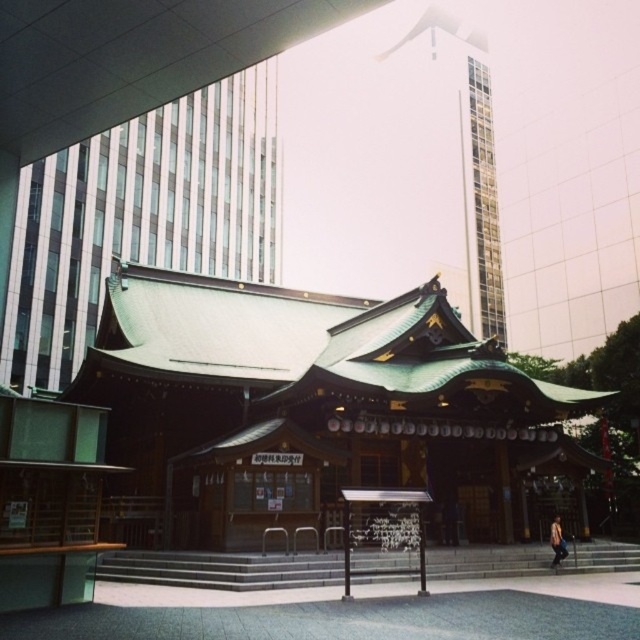
Does green shingled roof at upper left have a lesser height compared to green shingled roof at upper center?

Yes.

Is green shingled roof at upper left behind green shingled roof at upper center?

No, green shingled roof at upper left is in front of green shingled roof at upper center.

You are a GUI agent. You are given a task and a screenshot of the screen. Output one action in this format:
    pyautogui.click(x=<x>, y=<y>)
    Task: Click on the green shingled roof at upper left
    The image size is (640, 640).
    Given the screenshot: What is the action you would take?
    pyautogui.click(x=141, y=216)

Locate an element on the screen. Image resolution: width=640 pixels, height=640 pixels. green shingled roof at upper left is located at coordinates tap(141, 216).